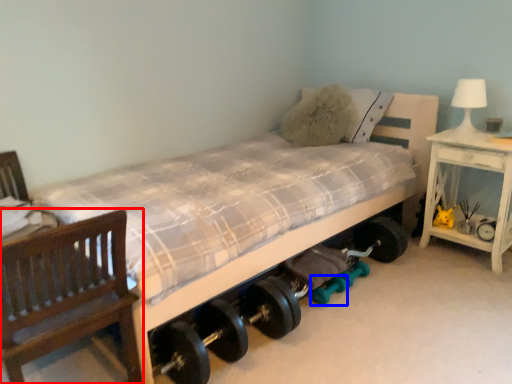
Question: Which object is further to the camera taking this photo, chair (highlighted by a red box) or dumbbell (highlighted by a blue box)?

Choices:
 (A) chair
 (B) dumbbell

Answer: (B)